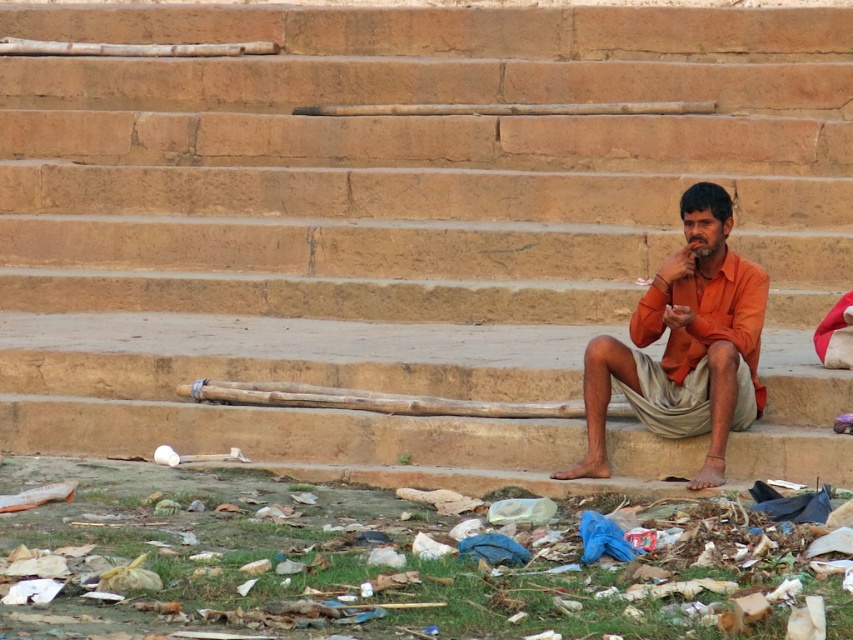
You are a park ranger inspecting the area. You notice the plastic bag at lower center and the orange cotton shirt at center. Which item is smaller in size?

The plastic bag at lower center is smaller than the orange cotton shirt at center.

You are a park ranger inspecting the area. You notice the plastic bag at lower center and the orange cotton shirt at center. Which item is closer to you from your vantage point?

The plastic bag at lower center is closer to you because it is in front of the orange cotton shirt at center.

You are a park ranger who notices the plastic bag at lower center and the orange cotton shirt at center on the ground. Which item is closer to the left side of the scene?

The plastic bag at lower center is to the left of the orange cotton shirt at center, so it is closer to the left side of the scene.